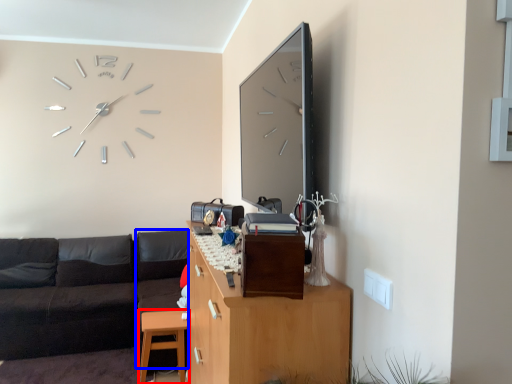
Question: Which point is closer to the camera, table (highlighted by a red box) or couch (highlighted by a blue box)?

Choices:
 (A) table
 (B) couch

Answer: (A)